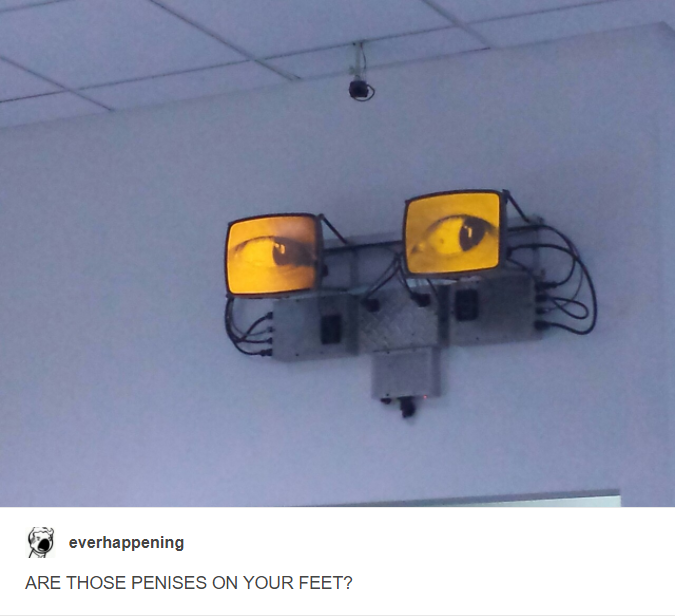
Identify the location of wall. (620, 199).